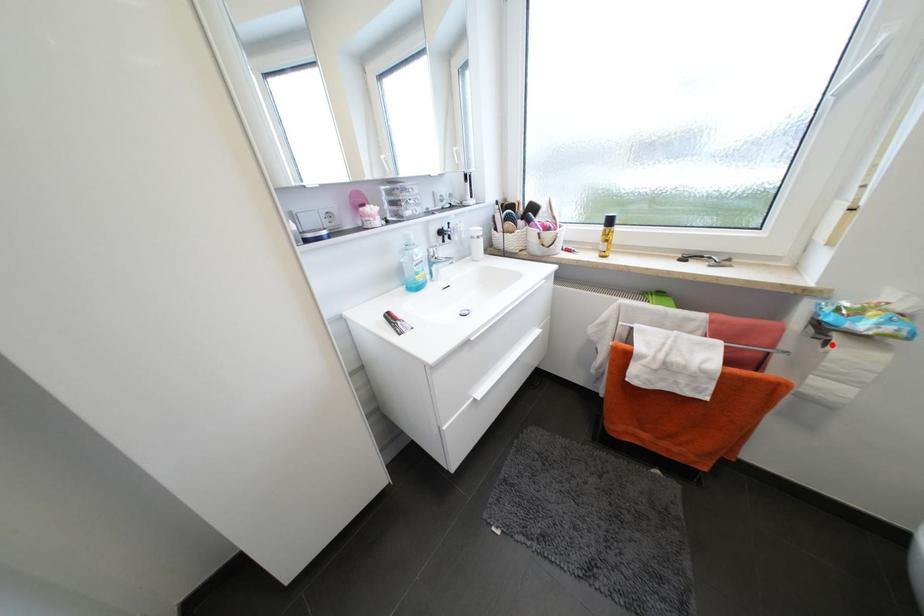
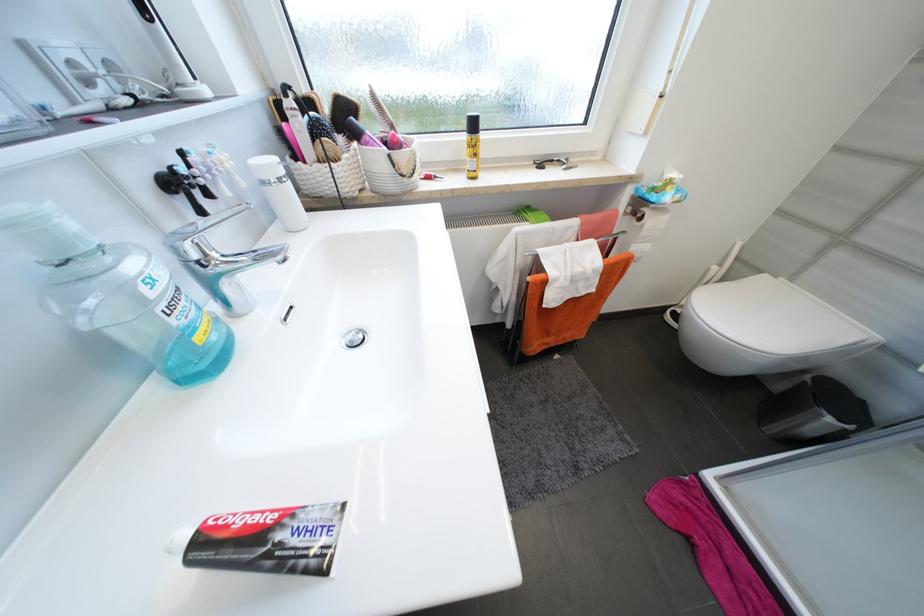
Where in the second image is the point corresponding to the highlighted location from the first image?

(647, 219)